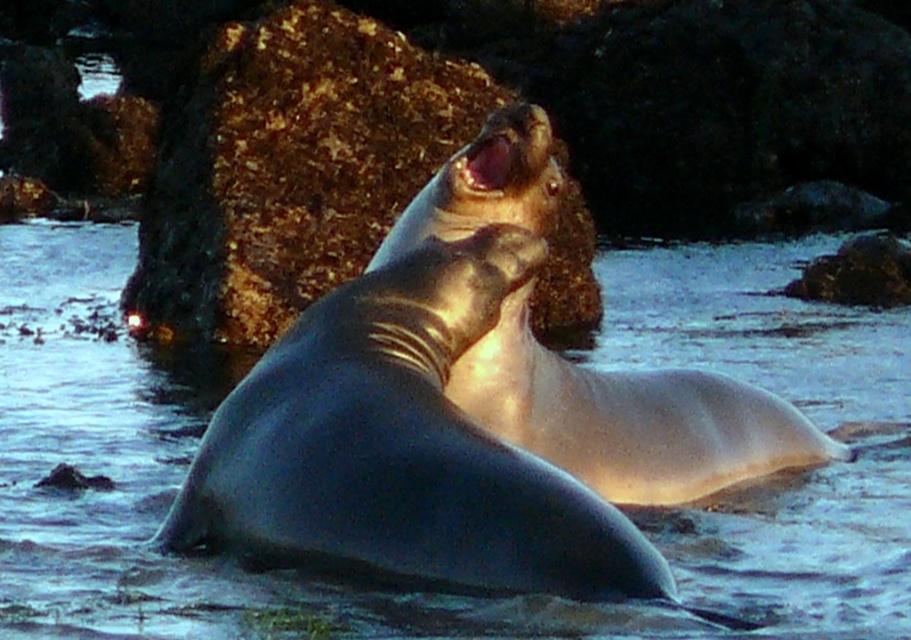
You are standing at the point labeled as point (63, 392) and want to take a photo of the sea lions. The camera you have can focus on objects up to 6 meters away. Will the camera be able to focus on the sea lions?

The distance of point (63, 392) from viewer is 6.69 meters, so the camera cannot focus on the sea lions because it is beyond the 6 meters range.

You are a marine biologist observing two sea lions in their natural habitat. You notice the clear water at seal left and the rusty rock at center. If you want to place a buoy between them to mark a safe distance for researchers, how far apart should you position the buoy from each object?

The clear water at seal left is 1.90 meters away from the rusty rock at center. To place the buoy exactly halfway between them, it should be positioned 0.95 meters from both the clear water at seal left and the rusty rock at center.